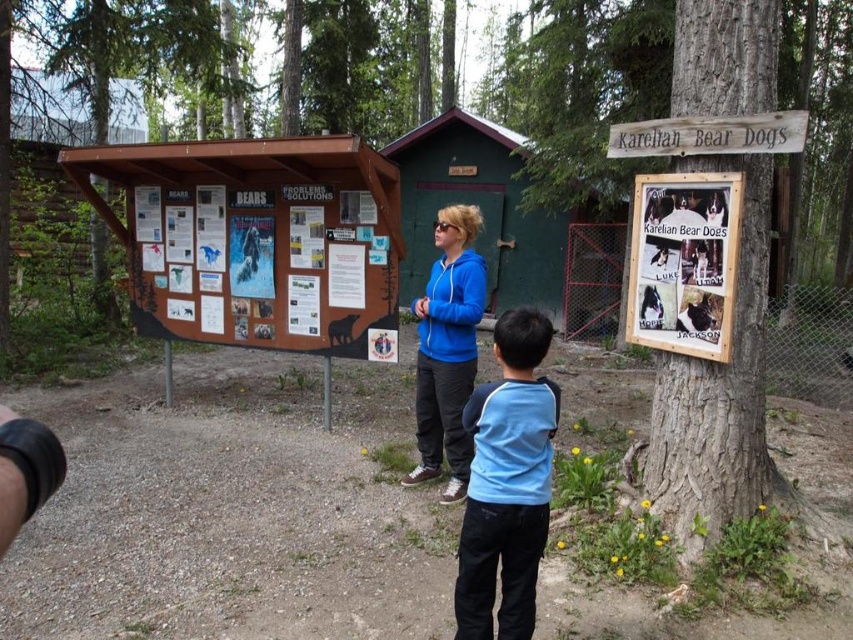
Is blue cotton shirt at center thinner than wooden signboard at upper right?

Yes.

Can you confirm if blue cotton shirt at center is positioned to the left of wooden signboard at upper right?

Indeed, blue cotton shirt at center is positioned on the left side of wooden signboard at upper right.

Who is more distant from viewer, [532,333] or [695,352]?

Positioned behind is point [695,352].

Locate an element on the screen. The width and height of the screenshot is (853, 640). blue cotton shirt at center is located at coordinates (508, 483).

Who is more distant from viewer, (619, 282) or (633, 225)?

Positioned behind is point (619, 282).

Between green wooden hut at center and wooden signboard at upper right, which one appears on the left side from the viewer's perspective?

From the viewer's perspective, green wooden hut at center appears more on the left side.

Who is more forward, (612, 259) or (666, 308)?

Positioned in front is point (666, 308).

Find the location of a particular element. green wooden hut at center is located at coordinates (508, 225).

Can you confirm if printed paper posters at left is wider than wooden sign at upper right?

Yes.

Does printed paper posters at left appear over wooden sign at upper right?

Incorrect, printed paper posters at left is not positioned above wooden sign at upper right.

What do you see at coordinates (264, 268) in the screenshot? I see `printed paper posters at left` at bounding box center [264, 268].

Locate an element on the screen. The image size is (853, 640). printed paper posters at left is located at coordinates (264, 268).